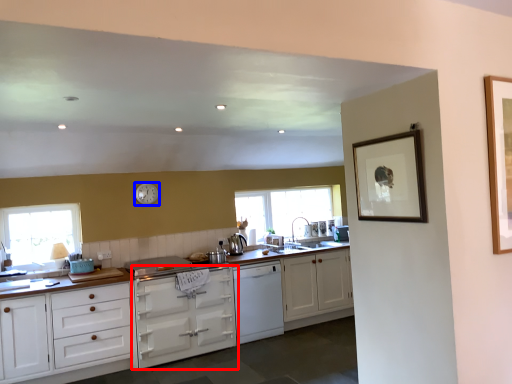
Question: Which object appears farthest to the camera in this image, cabinetry (highlighted by a red box) or clock (highlighted by a blue box)?

Choices:
 (A) cabinetry
 (B) clock

Answer: (B)